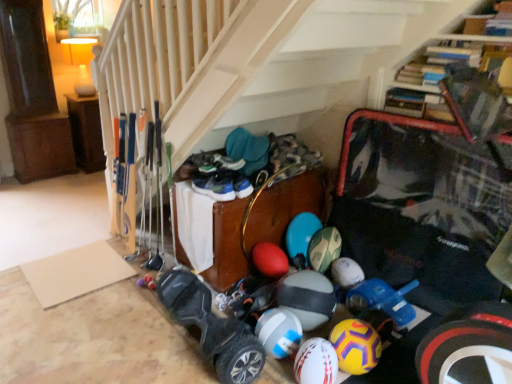
Where is `free space in front of brown wood cabinet at left, which is the 1th furniture from top to bottom`? free space in front of brown wood cabinet at left, which is the 1th furniture from top to bottom is located at coordinates (75, 180).